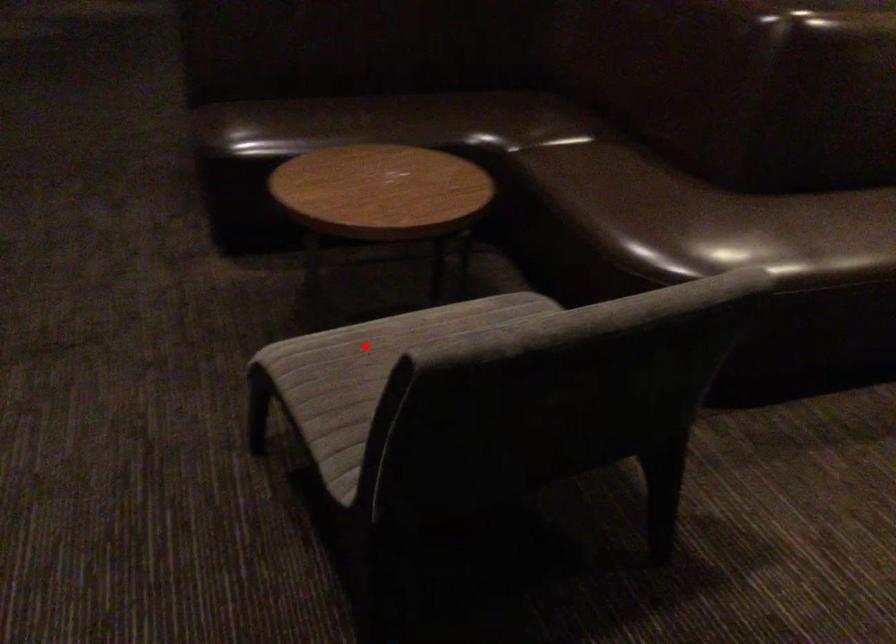
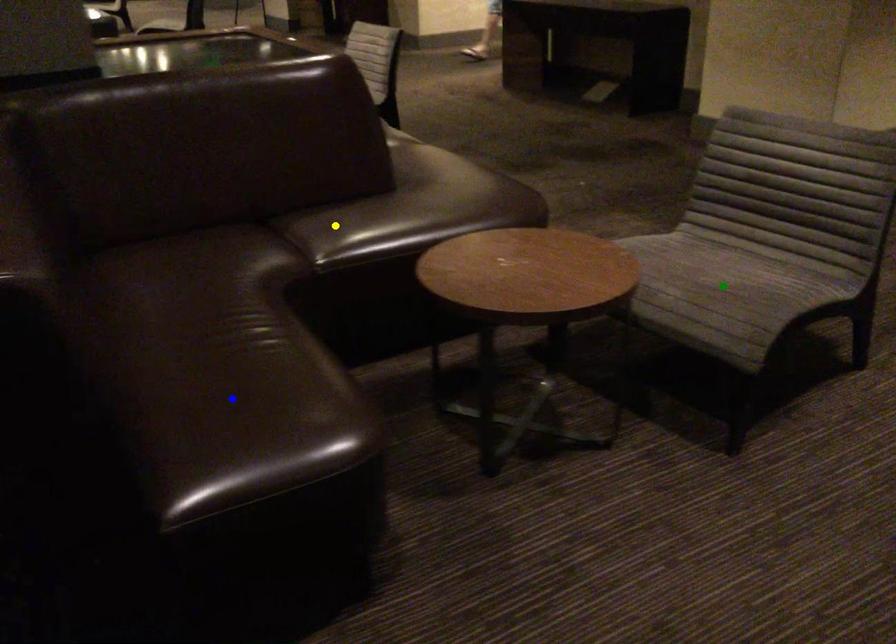
Question: I am providing you with two images of the same scene from different viewpoints. A red point is marked on the first image. You are given multiple points on the second image. Which point in image 2 is actually the same real-world point as the red point in image 1?

Choices:
 (A) green point
 (B) blue point
 (C) yellow point

Answer: (A)